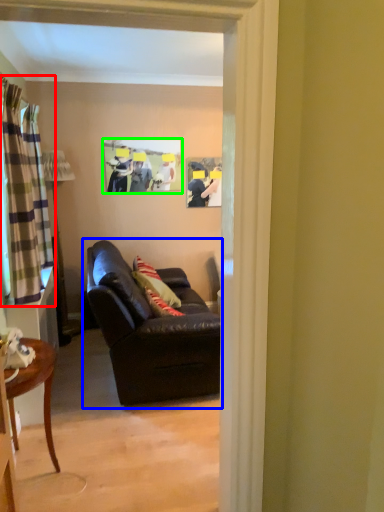
Question: Estimate the real-world distances between objects in this image. Which object is closer to curtain (highlighted by a red box), studio couch (highlighted by a blue box) or picture frame (highlighted by a green box)?

Choices:
 (A) studio couch
 (B) picture frame

Answer: (A)